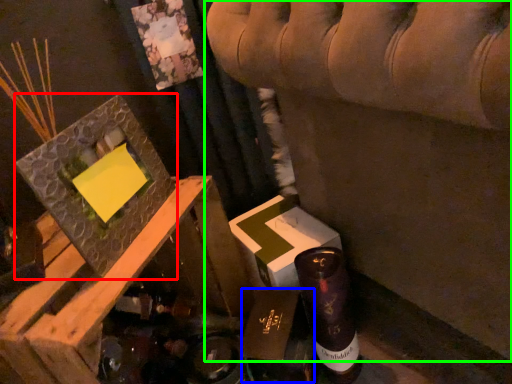
Question: Which is nearer to the picture frame (highlighted by a red box)? cardboard box (highlighted by a blue box) or furniture (highlighted by a green box).

Choices:
 (A) cardboard box
 (B) furniture

Answer: (A)